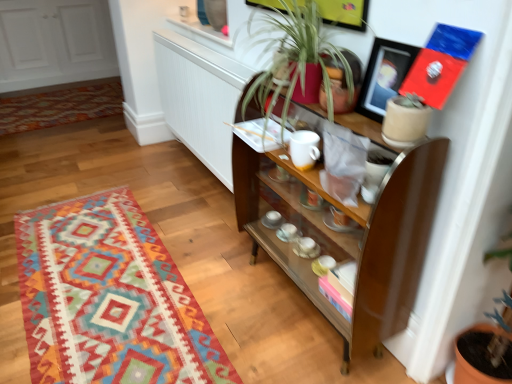
This screenshot has height=384, width=512. What do you see at coordinates (309, 39) in the screenshot?
I see `green leafy plant at center` at bounding box center [309, 39].

Find the location of a particular element. multicolored woven rug at lower left, which is counted as the 1th mat, starting from the top is located at coordinates (60, 105).

The width and height of the screenshot is (512, 384). What do you see at coordinates (60, 105) in the screenshot?
I see `multicolored woven rug at lower left, placed as the second mat when sorted from bottom to top` at bounding box center [60, 105].

From the picture: What is the approximate width of matte black picture frame at upper right?

matte black picture frame at upper right is 3.02 inches wide.

The width and height of the screenshot is (512, 384). What do you see at coordinates (349, 234) in the screenshot?
I see `brown wooden shelf at center` at bounding box center [349, 234].

From the picture: In order to face brown wooden shelf at center, should I rotate leftwards or rightwards?

To face it directly, rotate right by 7.496 degrees.

You are a GUI agent. You are given a task and a screenshot of the screen. Output one action in this format:
    pyautogui.click(x=<x>, y=<y>)
    Task: Click on the green leafy plant at center
    This screenshot has height=384, width=512.
    Given the screenshot: What is the action you would take?
    pyautogui.click(x=309, y=39)

From the picture: Is green leafy plant at center looking in the opposite direction of brown wooden shelf at center?

No.

Which of these two, green leafy plant at center or brown wooden shelf at center, is thinner?

brown wooden shelf at center is thinner.

From the image's perspective, is green leafy plant at center on brown wooden shelf at center?

Indeed, from the image's perspective, green leafy plant at center is shown above brown wooden shelf at center.

Which mat is the 2nd one when counting from the left side of the matte black picture frame at upper right? Please provide its 2D coordinates.

[(60, 105)]

Which object is further away from the camera, multicolored woven rug at lower left, which is counted as the 1th mat, starting from the top, or matte black picture frame at upper right?

multicolored woven rug at lower left, which is counted as the 1th mat, starting from the top, is behind.

Who is taller, multicolored woven rug at lower left, positioned as the second mat in front-to-back order, or matte black picture frame at upper right?

With more height is matte black picture frame at upper right.

From the image's perspective, would you say multicolored woven rug at lower left, placed as the second mat when sorted from bottom to top, is shown under matte black picture frame at upper right?

Actually, multicolored woven rug at lower left, placed as the second mat when sorted from bottom to top, appears above matte black picture frame at upper right in the image.

Considering the relative sizes of brown wooden shelf at center and multicolored woven rug at lower left, which is counted as the 1th mat, starting from the top, in the image provided, is brown wooden shelf at center smaller than multicolored woven rug at lower left, which is counted as the 1th mat, starting from the top,?

Actually, brown wooden shelf at center might be larger than multicolored woven rug at lower left, which is counted as the 1th mat, starting from the top.

What are the coordinates of `shelf in front of the multicolored woven rug at lower left, placed as the second mat when sorted from bottom to top` in the screenshot? It's located at (349, 234).

Is brown wooden shelf at center not close to multicolored woven rug at lower left, placed as the second mat when sorted from bottom to top?

Yes, brown wooden shelf at center and multicolored woven rug at lower left, placed as the second mat when sorted from bottom to top, are located far from each other.

In the scene shown: Considering the relative positions of brown wooden shelf at center and multicolored woven rug at lower left, positioned as the second mat in front-to-back order, in the image provided, is brown wooden shelf at center to the left of multicolored woven rug at lower left, positioned as the second mat in front-to-back order, from the viewer's perspective?

Incorrect, brown wooden shelf at center is not on the left side of multicolored woven rug at lower left, positioned as the second mat in front-to-back order.

Considering the sizes of brown wooden shelf at center and green leafy plant at center in the image, is brown wooden shelf at center bigger or smaller than green leafy plant at center?

brown wooden shelf at center is bigger than green leafy plant at center.

Is brown wooden shelf at center not close to green leafy plant at center?

brown wooden shelf at center is near green leafy plant at center, not far away.

From the image's perspective, is brown wooden shelf at center positioned above or below green leafy plant at center?

Based on their image positions, brown wooden shelf at center is located beneath green leafy plant at center.

Could you tell me if textured wool rug at lower left, which is the second mat in top-to-bottom order, is turned towards brown wooden shelf at center?

No.

Which is more to the left, textured wool rug at lower left, which is the second mat in top-to-bottom order, or brown wooden shelf at center?

Positioned to the left is textured wool rug at lower left, which is the second mat in top-to-bottom order.

Is the position of textured wool rug at lower left, the 2th mat when ordered from back to front, less distant than that of brown wooden shelf at center?

No, it is not.

Between green leafy plant at center and matte black picture frame at upper right, which one has larger width?

green leafy plant at center is wider.

From a real-world perspective, is green leafy plant at center located higher than matte black picture frame at upper right?

Yes, from a real-world perspective, green leafy plant at center is on top of matte black picture frame at upper right.

Is green leafy plant at center at the right side of matte black picture frame at upper right?

No, green leafy plant at center is not to the right of matte black picture frame at upper right.

Does matte black picture frame at upper right have a smaller size compared to green leafy plant at center?

Correct, matte black picture frame at upper right occupies less space than green leafy plant at center.

Is matte black picture frame at upper right situated inside green leafy plant at center or outside?

The correct answer is: inside.

Consider the image. Considering the sizes of matte black picture frame at upper right and green leafy plant at center in the image, is matte black picture frame at upper right wider or thinner than green leafy plant at center?

In the image, matte black picture frame at upper right appears to be more narrow than green leafy plant at center.

Considering the positions of points (370, 102) and (323, 72), is point (370, 102) farther from camera compared to point (323, 72)?

No, it is in front of (323, 72).

Find the location of a particular element. This screenshot has height=384, width=512. houseplant positioned vertically above the brown wooden shelf at center (from a real-world perspective) is located at coordinates (309, 39).

Identify the location of the 2nd mat behind when counting from the matte black picture frame at upper right. The height and width of the screenshot is (384, 512). (60, 105).

Estimate the real-world distances between objects in this image. Which object is closer to brown wooden shelf at center, multicolored woven rug at lower left, the first mat when ordered from back to front, or textured wool rug at lower left, the 2th mat when ordered from back to front?

Among the two, textured wool rug at lower left, the 2th mat when ordered from back to front, is located nearer to brown wooden shelf at center.

Which object lies further to the anchor point brown wooden shelf at center, matte black picture frame at upper right or textured wool rug at lower left, which ranks as the 1th mat in bottom-to-top order?

textured wool rug at lower left, which ranks as the 1th mat in bottom-to-top order.

Based on their spatial positions, is brown wooden shelf at center or multicolored woven rug at lower left, the first mat when ordered from back to front, further from green leafy plant at center?

multicolored woven rug at lower left, the first mat when ordered from back to front, is positioned further to the anchor green leafy plant at center.

Estimate the real-world distances between objects in this image. Which object is closer to matte black picture frame at upper right, textured wool rug at lower left, which is the second mat in top-to-bottom order, or multicolored woven rug at lower left, which is counted as the 1th mat, starting from the top?

Among the two, textured wool rug at lower left, which is the second mat in top-to-bottom order, is located nearer to matte black picture frame at upper right.

Based on their spatial positions, is green leafy plant at center or multicolored woven rug at lower left, positioned as the second mat in front-to-back order, closer to textured wool rug at lower left, the 2th mat when ordered from back to front?

green leafy plant at center is positioned closer to the anchor textured wool rug at lower left, the 2th mat when ordered from back to front.

When comparing their distances from textured wool rug at lower left, the 2th mat when ordered from back to front, does matte black picture frame at upper right or green leafy plant at center seem closer?

green leafy plant at center.

Considering their positions, is multicolored woven rug at lower left, placed as the second mat when sorted from bottom to top, positioned further to brown wooden shelf at center than matte black picture frame at upper right?

multicolored woven rug at lower left, placed as the second mat when sorted from bottom to top, is positioned further to the anchor brown wooden shelf at center.

From the image, which object appears to be nearer to multicolored woven rug at lower left, which is counted as the 1th mat, starting from the top, textured wool rug at lower left, placed as the 1th mat when sorted from front to back, or brown wooden shelf at center?

Among the two, textured wool rug at lower left, placed as the 1th mat when sorted from front to back, is located nearer to multicolored woven rug at lower left, which is counted as the 1th mat, starting from the top.

Where is `mat between matte black picture frame at upper right and multicolored woven rug at lower left, the first mat when ordered from back to front, from front to back`? The image size is (512, 384). mat between matte black picture frame at upper right and multicolored woven rug at lower left, the first mat when ordered from back to front, from front to back is located at coordinates (109, 299).

I want to click on houseplant between textured wool rug at lower left, which ranks as the 1th mat in bottom-to-top order, and matte black picture frame at upper right, so click(x=309, y=39).

This screenshot has height=384, width=512. I want to click on mat between green leafy plant at center and multicolored woven rug at lower left, placed as the second mat when sorted from bottom to top, from front to back, so click(109, 299).

Locate an element on the screen. The width and height of the screenshot is (512, 384). picture frame located between green leafy plant at center and multicolored woven rug at lower left, placed as the second mat when sorted from bottom to top, in the depth direction is located at coordinates (384, 76).